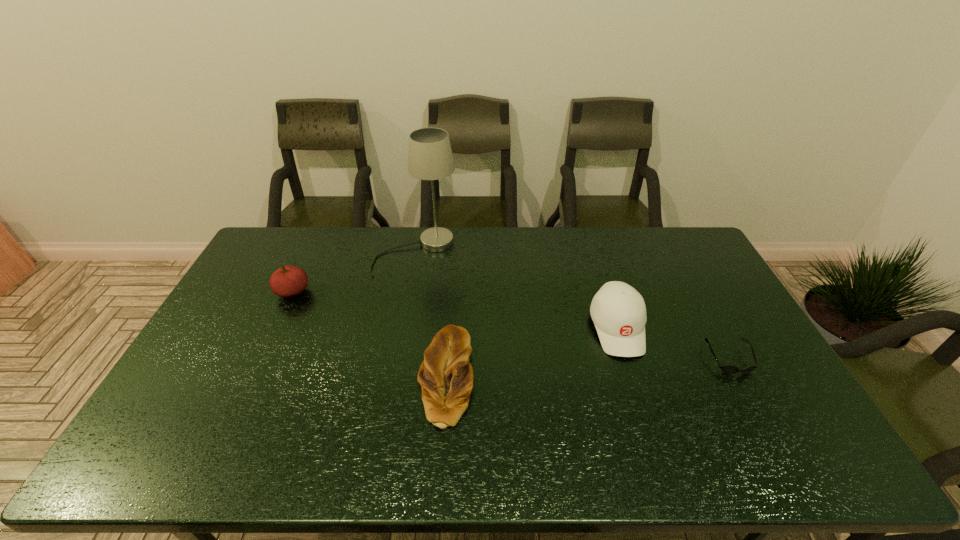
This screenshot has width=960, height=540. What are the coordinates of `table lamp` in the screenshot? It's located at click(430, 157).

Identify the location of the tallest object. The height and width of the screenshot is (540, 960). (430, 157).

Identify the location of the fourth object from left to right. (618, 311).

At what (x,y) coordinates should I click in order to perform the action: click on the leftmost object. Please return your answer as a coordinate pair (x, y). The width and height of the screenshot is (960, 540). Looking at the image, I should click on (287, 281).

Identify the location of the second shortest object. The width and height of the screenshot is (960, 540). (446, 377).

What are the coordinates of `the rightmost object` in the screenshot? It's located at (729, 369).

At what (x,y) coordinates should I click in order to perform the action: click on the shortest object. Please return your answer as a coordinate pair (x, y). This screenshot has width=960, height=540. Looking at the image, I should click on (729, 369).

Locate an element on the screen. vacant area situated 0.200m on the right of the tallest object is located at coordinates (511, 252).

Find the location of a particular element. This screenshot has width=960, height=540. free space located on the front-facing side of the baseball cap is located at coordinates (636, 386).

This screenshot has height=540, width=960. I want to click on vacant space located 0.200m on the front of the leftmost object, so click(265, 352).